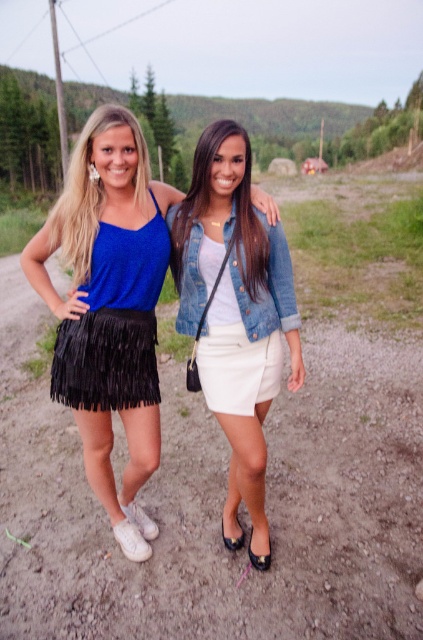
You are standing at the origin of a coordinate system placed at the bottom left corner of the image. The point given is in normalized coordinates. Which object is located at point (109, 307)?

The point (109, 307) indicates the location of the black fringed skirt at left.

You are a fashion designer observing two outfits in the image. The denim jacket at center and the white matte skirt at center are both central to your design analysis. Which of these two items has a greater horizontal spread when viewed from the front?

The denim jacket at center has a greater horizontal spread when viewed from the front since its width surpasses that of the white matte skirt at center.

Based on the photo, you are a photographer trying to capture a photo of the two people in the scene. You want to ensure that both the black fringed skirt at left and the denim jacket at center are clearly visible in your shot. Based on their positions, which direction should you position yourself relative to the subjects to best frame both objects in the image?

Since the black fringed skirt at left is to the left of the denim jacket at center, positioning yourself to the left side of the subjects would allow you to capture both objects in the frame effectively.